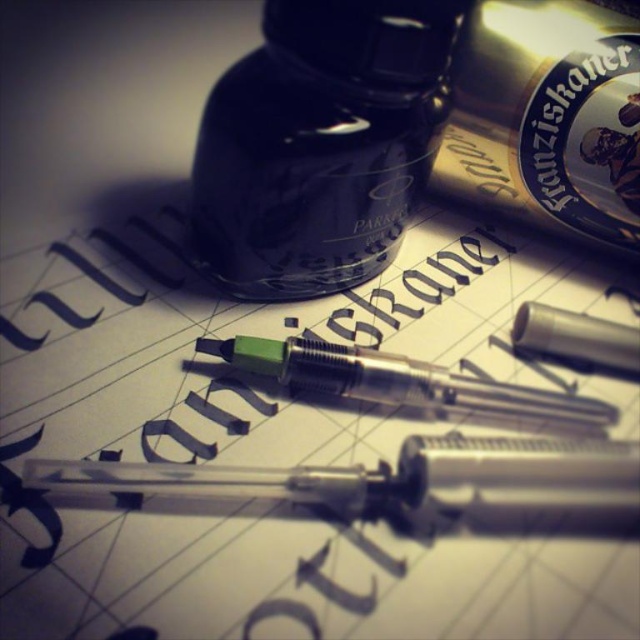
Question: Can you confirm if matte paper at center is bigger than transparent plastic pencil at center?

Choices:
 (A) yes
 (B) no

Answer: (A)

Question: Can you confirm if matte paper at center is thinner than matte black ink bottle at center?

Choices:
 (A) no
 (B) yes

Answer: (A)

Question: Estimate the real-world distances between objects in this image. Which object is closer to the matte black ink bottle at center?

Choices:
 (A) matte black ink at center
 (B) transparent plastic pencil at center
 (C) matte paper at center
 (D) green plastic pen at center

Answer: (A)

Question: Is transparent plastic pencil at center to the right of green plastic pen at center from the viewer's perspective?

Choices:
 (A) yes
 (B) no

Answer: (B)

Question: Among these objects, which one is farthest from the camera?

Choices:
 (A) matte black ink at center
 (B) gold metallic bottle at upper right
 (C) transparent plastic pencil at center

Answer: (B)

Question: Which point is closer to the camera taking this photo?

Choices:
 (A) (474, 540)
 (B) (332, 314)
 (C) (596, 504)
 (D) (483, 204)

Answer: (A)